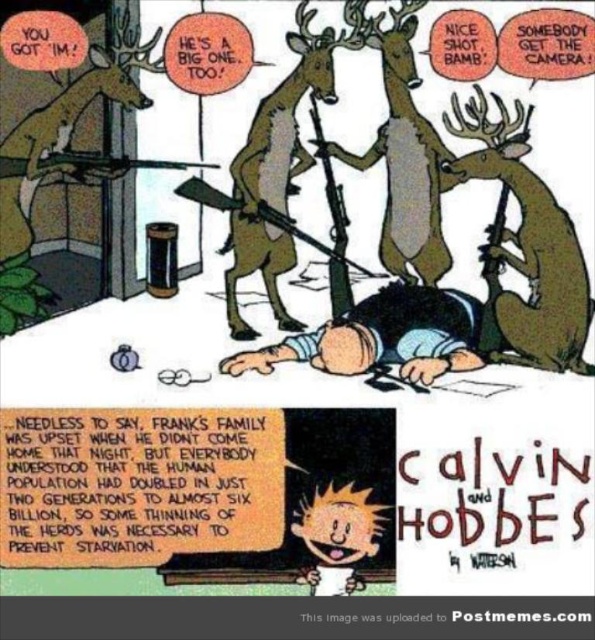
Consider the image. Is brown matte rifle at center above brown matte door at upper left?

Actually, brown matte rifle at center is below brown matte door at upper left.

The image size is (595, 640). I want to click on brown matte rifle at center, so click(402, 150).

You are a GUI agent. You are given a task and a screenshot of the screen. Output one action in this format:
    pyautogui.click(x=<x>, y=<y>)
    Task: Click on the brown matte rifle at center
    This screenshot has height=640, width=595.
    Given the screenshot: What is the action you would take?
    pyautogui.click(x=402, y=150)

Is brown matte deer at center above black matte person at lower center?

Indeed, brown matte deer at center is positioned over black matte person at lower center.

Is point (546, 186) closer to camera compared to point (268, 364)?

Yes, point (546, 186) is in front of point (268, 364).

The image size is (595, 640). Identify the location of brown matte deer at center. (524, 248).

Between point (289, 337) and point (295, 317), which one is positioned behind?

Point (295, 317)

Can you confirm if black matte person at lower center is smaller than brown fur deer at center?

Yes.

Locate an element on the screen. This screenshot has height=640, width=595. black matte person at lower center is located at coordinates [383, 337].

Where is `black matte person at lower center`? The height and width of the screenshot is (640, 595). black matte person at lower center is located at coordinates (383, 337).